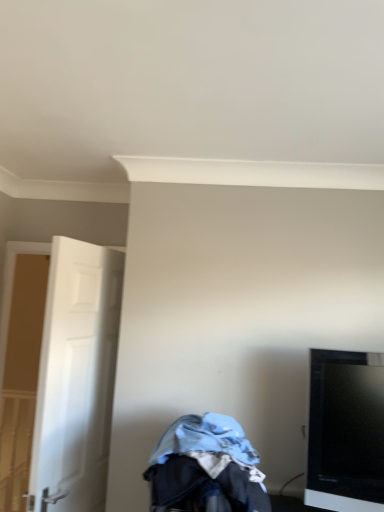
Question: Is white matte door at left facing towards black glossy tv at right?

Choices:
 (A) no
 (B) yes

Answer: (B)

Question: Is white matte door at left facing away from black glossy tv at right?

Choices:
 (A) no
 (B) yes

Answer: (B)

Question: From the image's perspective, would you say white matte door at left is shown under black glossy tv at right?

Choices:
 (A) yes
 (B) no

Answer: (B)

Question: Is white matte door at left outside of black glossy tv at right?

Choices:
 (A) no
 (B) yes

Answer: (B)

Question: Would you say white matte door at left is a long distance from black glossy tv at right?

Choices:
 (A) no
 (B) yes

Answer: (B)

Question: Considering the relative positions of denim fabric baby carriage at lower center and black glossy tv at right in the image provided, is denim fabric baby carriage at lower center to the left or to the right of black glossy tv at right?

Choices:
 (A) left
 (B) right

Answer: (A)

Question: Does point [235, 420] appear closer or farther from the camera than point [311, 397]?

Choices:
 (A) farther
 (B) closer

Answer: (A)

Question: In the image, is denim fabric baby carriage at lower center positioned in front of or behind black glossy tv at right?

Choices:
 (A) front
 (B) behind

Answer: (A)

Question: Is denim fabric baby carriage at lower center inside or outside of black glossy tv at right?

Choices:
 (A) inside
 (B) outside

Answer: (B)

Question: From a real-world perspective, is white matte door at left positioned above or below denim fabric baby carriage at lower center?

Choices:
 (A) below
 (B) above

Answer: (B)

Question: Looking at the image, does white matte door at left seem bigger or smaller compared to denim fabric baby carriage at lower center?

Choices:
 (A) big
 (B) small

Answer: (A)

Question: Is white matte door at left taller or shorter than denim fabric baby carriage at lower center?

Choices:
 (A) tall
 (B) short

Answer: (A)

Question: From the image's perspective, is white matte door at left located above or below denim fabric baby carriage at lower center?

Choices:
 (A) above
 (B) below

Answer: (A)

Question: In the image, is black glossy tv at right on the left side or the right side of white matte door at left?

Choices:
 (A) left
 (B) right

Answer: (B)

Question: From a real-world perspective, is black glossy tv at right physically located above or below white matte door at left?

Choices:
 (A) below
 (B) above

Answer: (A)